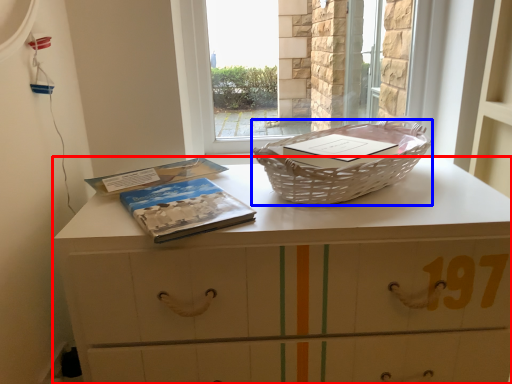
Question: Which object is further to the camera taking this photo, chest of drawers (highlighted by a red box) or picnic basket (highlighted by a blue box)?

Choices:
 (A) chest of drawers
 (B) picnic basket

Answer: (B)